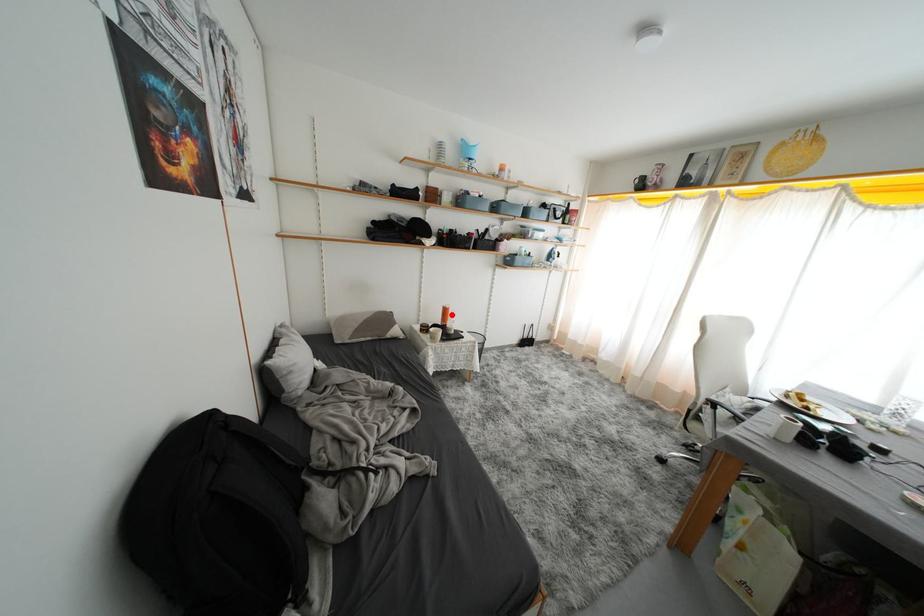
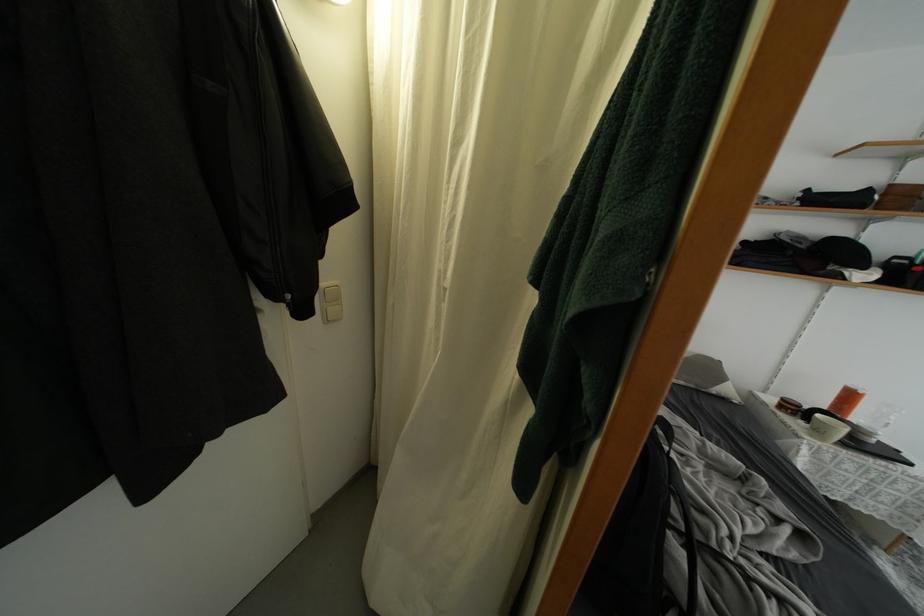
The point at the highlighted location is marked in the first image. Where is the corresponding point in the second image?

(856, 400)